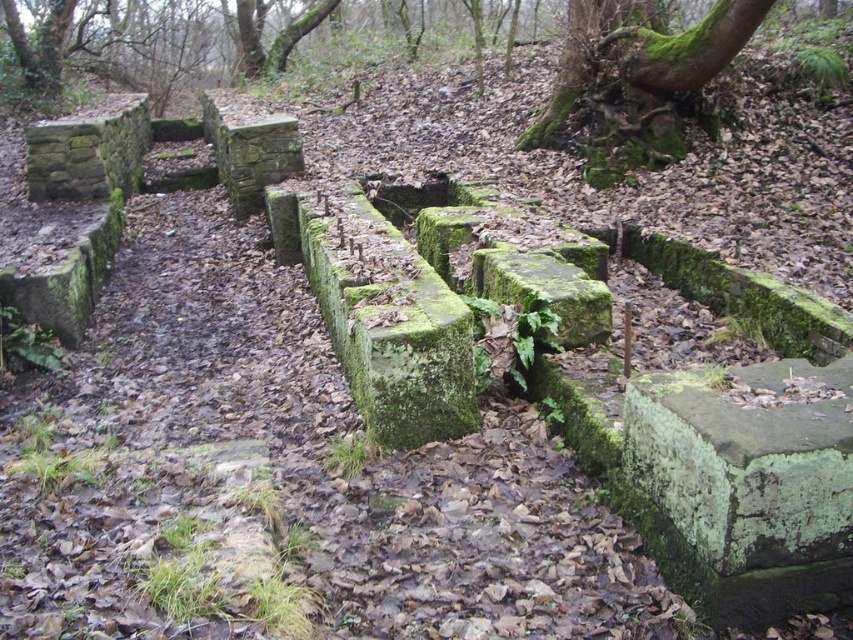
You are standing in the forest scene and want to walk from the green mossy stone at upper left to the green mossy stone at lower right. Which direction should you move relative to your current position?

You should move to the right because the green mossy stone at lower right is positioned on the right side of the green mossy stone at upper left.

You are standing in the forest scene and want to walk from the green mossy stone at lower right to the green mossy stone at upper left. Which direction should you move to get closer to your destination?

To move from the green mossy stone at lower right to the green mossy stone at upper left, you should move towards the upper left direction since the green mossy stone at upper left is your destination and the one at lower right is your starting point.

What is located at the point with coordinates (88, 150) in the image?

The point at coordinates (88, 150) indicates the location of the green mossy stone at upper left.